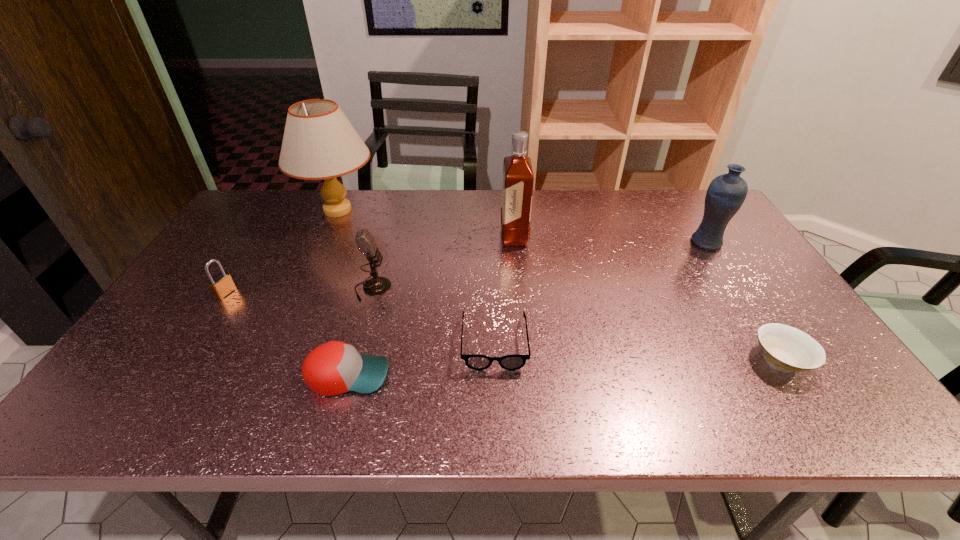
Find the location of a particular element. Image resolution: width=960 pixels, height=540 pixels. vacant space at the near left corner of the desktop is located at coordinates (112, 392).

Find the location of a particular element. The height and width of the screenshot is (540, 960). free space at the far right corner is located at coordinates (703, 195).

You are a GUI agent. You are given a task and a screenshot of the screen. Output one action in this format:
    pyautogui.click(x=<x>, y=<y>)
    Task: Click on the free space between the lampshade and the padlock
    
    Given the screenshot: What is the action you would take?
    pyautogui.click(x=281, y=252)

Locate an element on the screen. Image resolution: width=960 pixels, height=540 pixels. vacant point located between the bowl and the lampshade is located at coordinates (560, 285).

This screenshot has height=540, width=960. What are the coordinates of `vacant point located between the liquor and the lampshade` in the screenshot? It's located at (426, 223).

You are a GUI agent. You are given a task and a screenshot of the screen. Output one action in this format:
    pyautogui.click(x=<x>, y=<y>)
    Task: Click on the free spot between the fourth tallest object and the lampshade
    This screenshot has width=960, height=540.
    Given the screenshot: What is the action you would take?
    pyautogui.click(x=355, y=249)

Locate an element on the screen. This screenshot has width=960, height=540. empty space that is in between the padlock and the liquor is located at coordinates (370, 265).

Where is `empty location between the microphone and the leftmost object`? Image resolution: width=960 pixels, height=540 pixels. empty location between the microphone and the leftmost object is located at coordinates (299, 291).

Locate an element on the screen. vacant point located between the microphone and the baseball cap is located at coordinates (360, 332).

Locate an element on the screen. vacant point located between the liquor and the sixth tallest object is located at coordinates (431, 306).